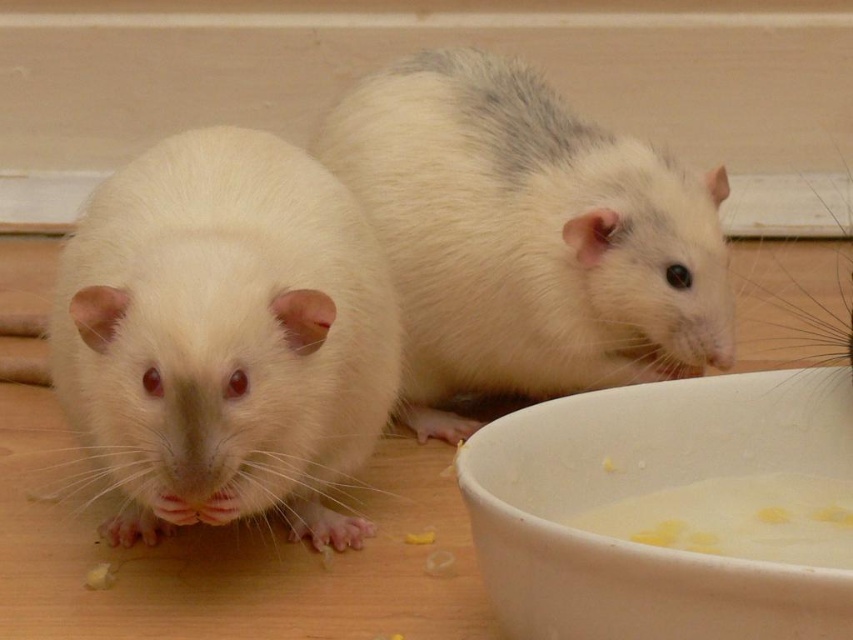
In the scene shown: You are a small animal trying to reach the food bowl. You are currently at point (395, 140). There is an obstacle at point (210, 490). Can you go around the obstacle to reach the bowl?

The point (210, 490) is in front of point (395, 140), so the obstacle is blocking your path. You need to go around it to reach the bowl.

You are standing at the origin of a coordinate system where the image is displayed. The white matte bowl at lower right is represented by point (639, 490). If you want to place a new object exactly halfway between the origin and the bowl, what are the coordinates of that point?

The coordinates of the halfway point between the origin and the white matte bowl at lower right would be half of 0.767 and half of 0.750, so the point would be at 0.3835, 0.375.

You are a photographer trying to capture a closeup of the rodent on the left. You notice two points marked in the image, point 1 at coordinates point (547, 636) and point 2 at coordinates point (749, 531). Which point should you focus on to get the best closeup of the rodent on the left?

Point (547, 636) is closer to the camera than point (749, 531), so focusing on point (547, 636) would provide a better closeup of the rodent on the left.